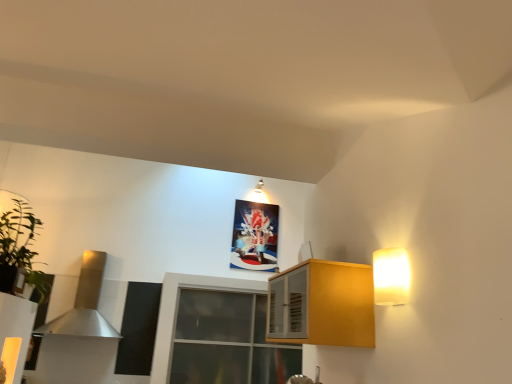
Question: Is the position of white glossy light fixture at upper center, which ranks as the first light fixture in top-to-bottom order, less distant than that of transparent glass window at center?

Choices:
 (A) no
 (B) yes

Answer: (A)

Question: From a real-world perspective, does white glossy light fixture at upper center, arranged as the 2th light fixture when ordered from the bottom, stand above transparent glass window at center?

Choices:
 (A) yes
 (B) no

Answer: (A)

Question: Is transparent glass window at center at the back of white glossy light fixture at upper center, the first light fixture when ordered from left to right?

Choices:
 (A) no
 (B) yes

Answer: (A)

Question: Can you confirm if white glossy light fixture at upper center, which ranks as the second light fixture in right-to-left order, is taller than transparent glass window at center?

Choices:
 (A) yes
 (B) no

Answer: (B)

Question: Is white glossy light fixture at upper center, which appears as the 1th light fixture when viewed from the back, outside transparent glass window at center?

Choices:
 (A) no
 (B) yes

Answer: (B)

Question: From their relative heights in the image, would you say white glossy light fixture at upper center, the first light fixture when ordered from left to right, is taller or shorter than green leafy plant at left?

Choices:
 (A) short
 (B) tall

Answer: (A)

Question: Is white glossy light fixture at upper center, the first light fixture when ordered from left to right, to the left or to the right of green leafy plant at left in the image?

Choices:
 (A) left
 (B) right

Answer: (B)

Question: Based on their sizes in the image, would you say white glossy light fixture at upper center, which appears as the 1th light fixture when viewed from the back, is bigger or smaller than green leafy plant at left?

Choices:
 (A) small
 (B) big

Answer: (A)

Question: Is point (261, 188) positioned closer to the camera than point (10, 273)?

Choices:
 (A) farther
 (B) closer

Answer: (A)

Question: Is transparent glass window at center situated inside matte plastic picture frame at upper center or outside?

Choices:
 (A) inside
 (B) outside

Answer: (B)

Question: Based on their positions, is transparent glass window at center located to the left or right of matte plastic picture frame at upper center?

Choices:
 (A) right
 (B) left

Answer: (B)

Question: Considering their positions, is transparent glass window at center located in front of or behind matte plastic picture frame at upper center?

Choices:
 (A) front
 (B) behind

Answer: (A)

Question: In terms of height, does transparent glass window at center look taller or shorter compared to matte plastic picture frame at upper center?

Choices:
 (A) tall
 (B) short

Answer: (A)

Question: In terms of size, does transparent glass window at center appear bigger or smaller than green leafy plant at left?

Choices:
 (A) big
 (B) small

Answer: (A)

Question: Is transparent glass window at center taller or shorter than green leafy plant at left?

Choices:
 (A) short
 (B) tall

Answer: (B)